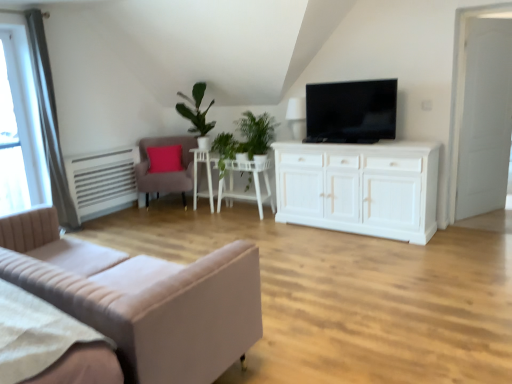
Question: From the image's perspective, does white glossy side table at center appear lower than transparent glass window at upper left?

Choices:
 (A) no
 (B) yes

Answer: (B)

Question: Considering the relative positions of white glossy side table at center and transparent glass window at upper left in the image provided, is white glossy side table at center in front of transparent glass window at upper left?

Choices:
 (A) yes
 (B) no

Answer: (B)

Question: Does white glossy side table at center have a smaller size compared to transparent glass window at upper left?

Choices:
 (A) yes
 (B) no

Answer: (A)

Question: Considering the relative sizes of white glossy side table at center and transparent glass window at upper left in the image provided, is white glossy side table at center shorter than transparent glass window at upper left?

Choices:
 (A) yes
 (B) no

Answer: (A)

Question: Can you confirm if white glossy side table at center is thinner than transparent glass window at upper left?

Choices:
 (A) yes
 (B) no

Answer: (B)

Question: From the image's perspective, is white glossy side table at center located above transparent glass window at upper left?

Choices:
 (A) yes
 (B) no

Answer: (B)

Question: Is black glossy tv at upper center at the right side of velvet pink armchair at left?

Choices:
 (A) yes
 (B) no

Answer: (A)

Question: From a real-world perspective, is black glossy tv at upper center beneath velvet pink armchair at left?

Choices:
 (A) yes
 (B) no

Answer: (B)

Question: Is black glossy tv at upper center outside velvet pink armchair at left?

Choices:
 (A) no
 (B) yes

Answer: (B)

Question: Is black glossy tv at upper center looking in the opposite direction of velvet pink armchair at left?

Choices:
 (A) no
 (B) yes

Answer: (A)

Question: Is black glossy tv at upper center shorter than velvet pink armchair at left?

Choices:
 (A) no
 (B) yes

Answer: (B)

Question: Is black glossy tv at upper center positioned before velvet pink armchair at left?

Choices:
 (A) no
 (B) yes

Answer: (B)

Question: From a real-world perspective, is white glossy side table at center positioned under white wooden door at right based on gravity?

Choices:
 (A) no
 (B) yes

Answer: (B)